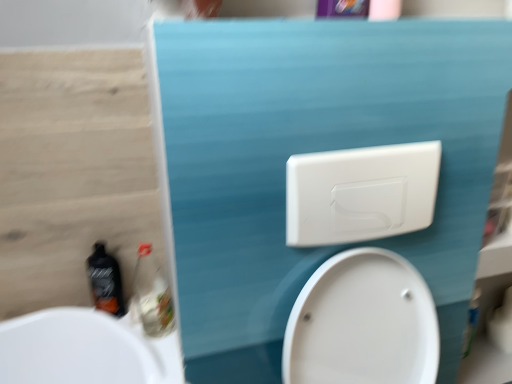
Question: Is white plastic toilet flush handle at upper center to the right of wooden at left from the viewer's perspective?

Choices:
 (A) yes
 (B) no

Answer: (A)

Question: From the image's perspective, is white plastic toilet flush handle at upper center on wooden at left?

Choices:
 (A) yes
 (B) no

Answer: (B)

Question: Can you confirm if white plastic toilet flush handle at upper center is wider than wooden at left?

Choices:
 (A) no
 (B) yes

Answer: (B)

Question: Does white plastic toilet flush handle at upper center have a greater height compared to wooden at left?

Choices:
 (A) no
 (B) yes

Answer: (A)

Question: Is white plastic toilet flush handle at upper center not near wooden at left?

Choices:
 (A) no
 (B) yes

Answer: (A)

Question: From a real-world perspective, relative to white glossy toilet at center, is white plastic toilet flush handle at upper center vertically above or below?

Choices:
 (A) below
 (B) above

Answer: (B)

Question: Is white plastic toilet flush handle at upper center taller or shorter than white glossy toilet at center?

Choices:
 (A) tall
 (B) short

Answer: (B)

Question: In terms of size, does white plastic toilet flush handle at upper center appear bigger or smaller than white glossy toilet at center?

Choices:
 (A) big
 (B) small

Answer: (B)

Question: Is white plastic toilet flush handle at upper center inside the boundaries of white glossy toilet at center, or outside?

Choices:
 (A) outside
 (B) inside

Answer: (A)

Question: In terms of height, does white glossy toilet at center look taller or shorter compared to wooden at left?

Choices:
 (A) short
 (B) tall

Answer: (A)

Question: Would you say white glossy toilet at center is inside or outside wooden at left?

Choices:
 (A) outside
 (B) inside

Answer: (A)

Question: Is white glossy toilet at center bigger or smaller than wooden at left?

Choices:
 (A) big
 (B) small

Answer: (A)

Question: From a real-world perspective, relative to wooden at left, is white glossy toilet at center vertically above or below?

Choices:
 (A) below
 (B) above

Answer: (A)

Question: Relative to white glossy toilet at center, is white matte toilet paper at lower right in front or behind?

Choices:
 (A) behind
 (B) front

Answer: (A)

Question: Considering the relative positions of white matte toilet paper at lower right and white glossy toilet at center in the image provided, is white matte toilet paper at lower right to the left or to the right of white glossy toilet at center?

Choices:
 (A) right
 (B) left

Answer: (A)